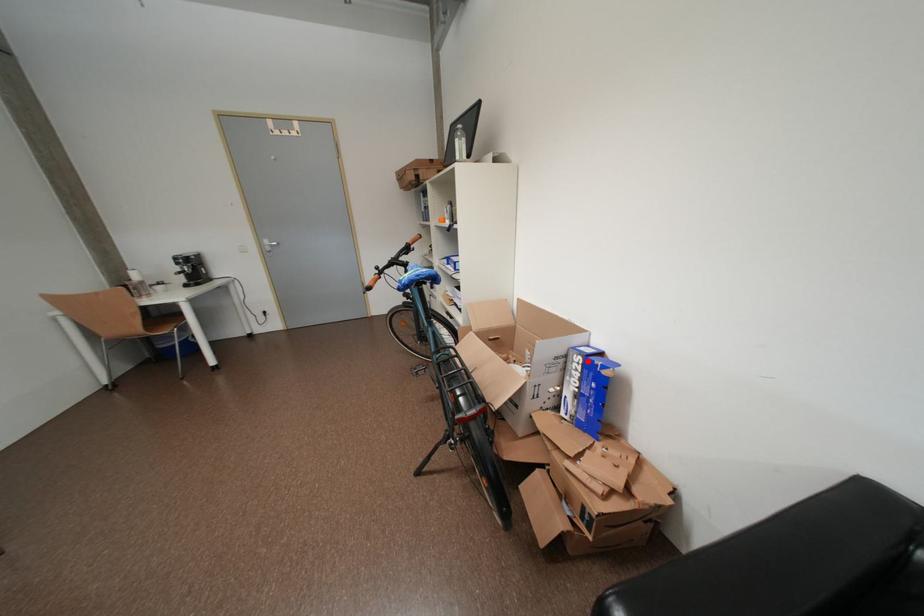
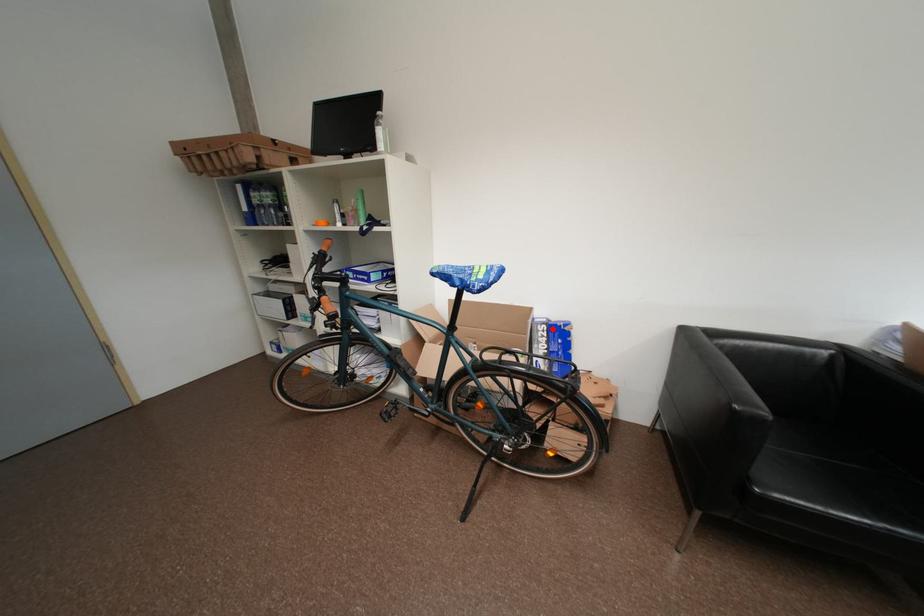
I am providing you with two images of the same scene from different viewpoints. A red point is marked on the first image and another point is marked on the second image. Does the point marked in image1 correspond to the same location as the one in image2?

Yes